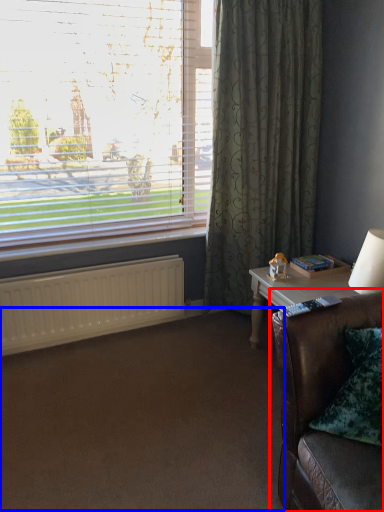
Question: Which object is closer to the camera taking this photo, studio couch (highlighted by a red box) or plain (highlighted by a blue box)?

Choices:
 (A) studio couch
 (B) plain

Answer: (A)